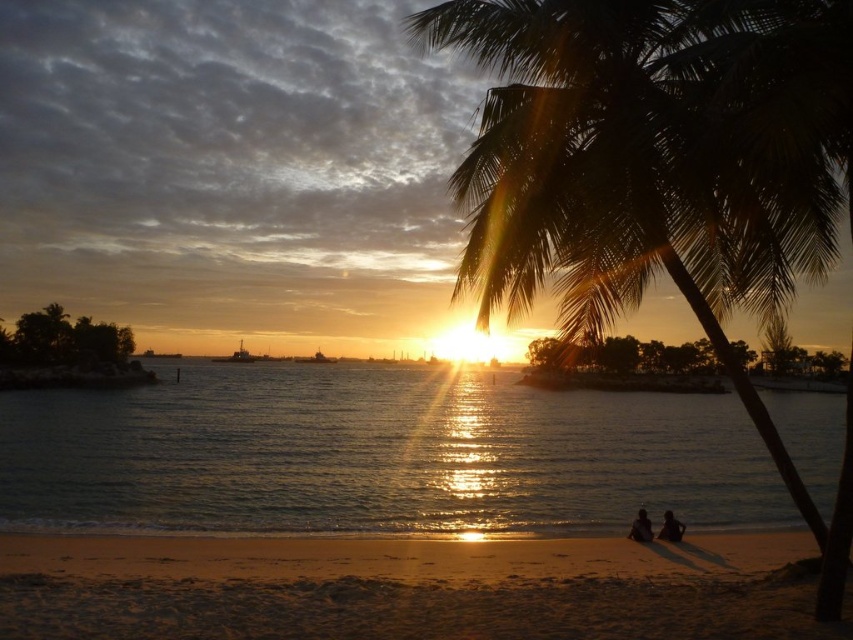
Between sandy beach at lower center and smooth skin couple at lower center, which one appears on the left side from the viewer's perspective?

Positioned to the left is sandy beach at lower center.

Is sandy beach at lower center thinner than smooth skin couple at lower center?

Incorrect, sandy beach at lower center's width is not less than smooth skin couple at lower center's.

You are a GUI agent. You are given a task and a screenshot of the screen. Output one action in this format:
    pyautogui.click(x=<x>, y=<y>)
    Task: Click on the sandy beach at lower center
    
    Given the screenshot: What is the action you would take?
    pyautogui.click(x=409, y=588)

Is sandy beach at lower center shorter than dark skin human at lower right?

Incorrect, sandy beach at lower center's height does not fall short of dark skin human at lower right's.

What do you see at coordinates (409, 588) in the screenshot?
I see `sandy beach at lower center` at bounding box center [409, 588].

In order to click on sandy beach at lower center in this screenshot , I will do `click(409, 588)`.

Is point (637, 516) closer to camera compared to point (659, 538)?

No.

Can you confirm if silhouette human at lower right is positioned below dark skin human at lower right?

Yes.

Image resolution: width=853 pixels, height=640 pixels. In order to click on silhouette human at lower right in this screenshot , I will do `click(640, 528)`.